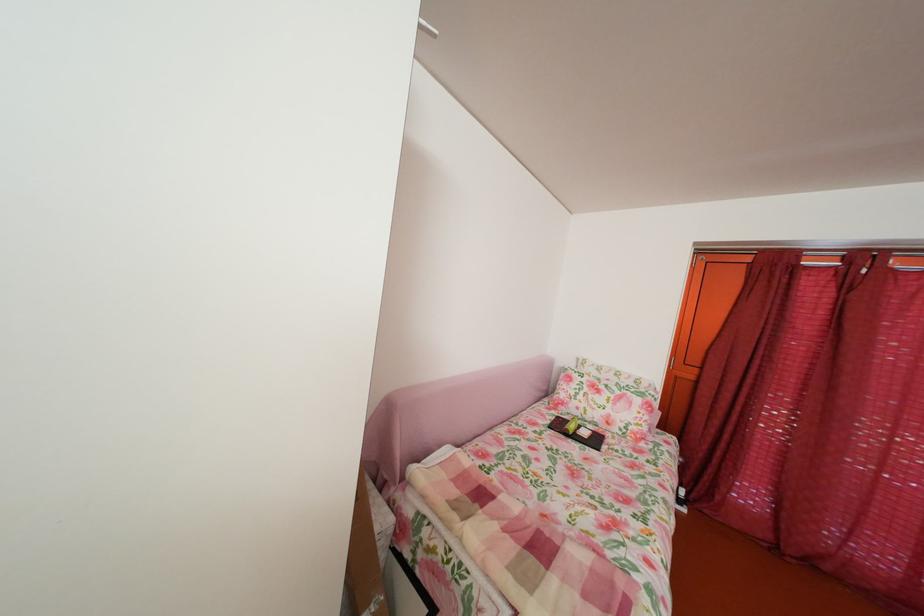
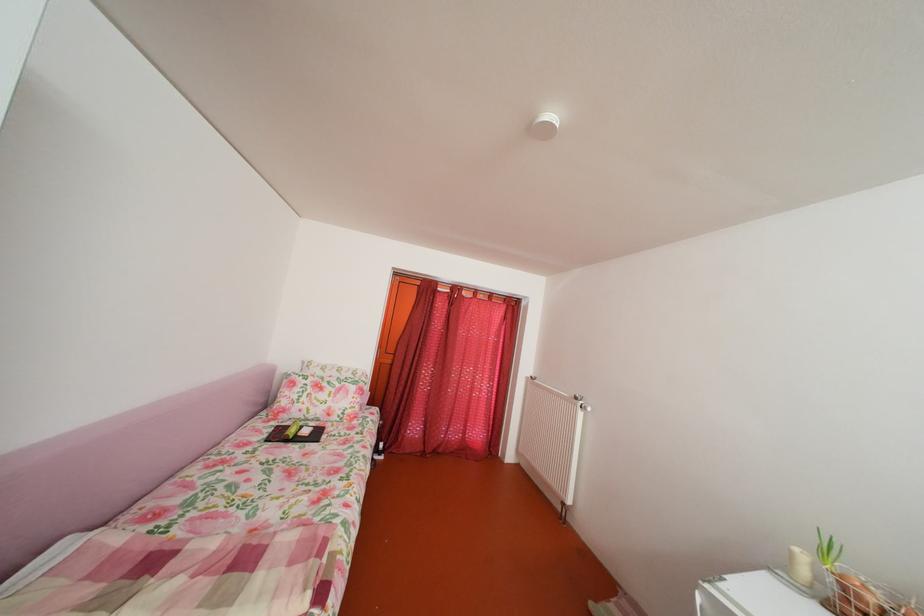
Locate, in the second image, the point that corresponds to (x=565, y=419) in the first image.

(286, 430)